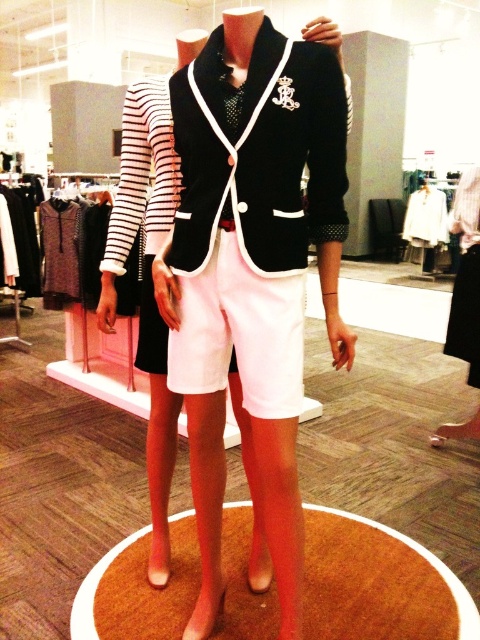
Question: Which object appears closest to the camera in this image?

Choices:
 (A) white cotton shorts at center
 (B) velvet black blazer at center
 (C) satin black blazer at center

Answer: (B)

Question: Considering the relative positions of satin black blazer at center and white cotton shorts at center in the image provided, where is satin black blazer at center located with respect to white cotton shorts at center?

Choices:
 (A) left
 (B) right

Answer: (B)

Question: Which point is closer to the camera taking this photo?

Choices:
 (A) pyautogui.click(x=312, y=65)
 (B) pyautogui.click(x=273, y=355)
 (C) pyautogui.click(x=206, y=64)

Answer: (A)

Question: Based on their relative distances, which object is farther from the velvet black blazer at center?

Choices:
 (A) white cotton shorts at center
 (B) satin black blazer at center

Answer: (A)

Question: Where is satin black blazer at center located in relation to white cotton shorts at center in the image?

Choices:
 (A) above
 (B) below

Answer: (B)

Question: Does satin black blazer at center come in front of white cotton shorts at center?

Choices:
 (A) yes
 (B) no

Answer: (A)